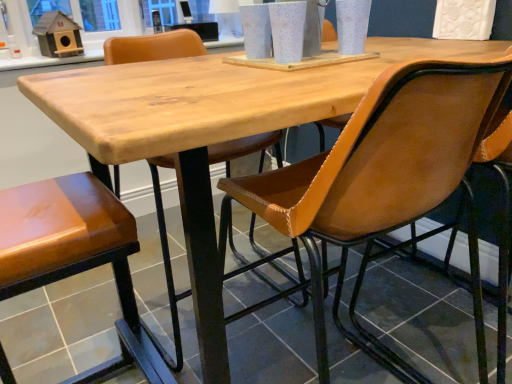
The width and height of the screenshot is (512, 384). What do you see at coordinates (76, 256) in the screenshot?
I see `glossy brown leather chair at lower left, positioned as the first chair in left-to-right order` at bounding box center [76, 256].

You are a GUI agent. You are given a task and a screenshot of the screen. Output one action in this format:
    pyautogui.click(x=<x>, y=<y>)
    Task: Click on the glossy brown leather chair at lower left, positioned as the 2th chair in right-to-left order
    
    Given the screenshot: What is the action you would take?
    pyautogui.click(x=76, y=256)

This screenshot has height=384, width=512. What are the coordinates of `brown leather chair at center, which ranks as the 2th chair in left-to-right order` in the screenshot? It's located at click(x=381, y=178).

Consider the image. In order to face brown leather chair at center, which ranks as the 2th chair in left-to-right order, should I rotate leftwards or rightwards?

It's best to rotate right around 12.313 degrees.

Describe the element at coordinates (381, 178) in the screenshot. I see `brown leather chair at center, which ranks as the 2th chair in left-to-right order` at that location.

Find the location of `glossy brown leather chair at lower left, positioned as the first chair in left-to-right order`. glossy brown leather chair at lower left, positioned as the first chair in left-to-right order is located at coordinates (76, 256).

Considering the positions of objects glossy brown leather chair at lower left, positioned as the first chair in left-to-right order, and brown leather chair at center, arranged as the first chair when viewed from the right, in the image provided, who is more to the left, glossy brown leather chair at lower left, positioned as the first chair in left-to-right order, or brown leather chair at center, arranged as the first chair when viewed from the right,?

glossy brown leather chair at lower left, positioned as the first chair in left-to-right order, is more to the left.

Based on the photo, which object is more forward, glossy brown leather chair at lower left, positioned as the 2th chair in right-to-left order, or brown leather chair at center, which ranks as the 2th chair in left-to-right order?

Answer: brown leather chair at center, which ranks as the 2th chair in left-to-right order, is closer to the camera.

Which is farther from the camera, [27,225] or [320,279]?

The point [320,279] is farther from the camera.

From the image's perspective, relative to brown leather chair at center, which ranks as the 2th chair in left-to-right order, is glossy brown leather chair at lower left, positioned as the first chair in left-to-right order, above or below?

glossy brown leather chair at lower left, positioned as the first chair in left-to-right order, is below brown leather chair at center, which ranks as the 2th chair in left-to-right order.

From a real-world perspective, is glossy brown leather chair at lower left, positioned as the first chair in left-to-right order, over brown leather chair at center, arranged as the first chair when viewed from the right?

No, from a real-world perspective, glossy brown leather chair at lower left, positioned as the first chair in left-to-right order, is not above brown leather chair at center, arranged as the first chair when viewed from the right.

Considering the sizes of glossy brown leather chair at lower left, positioned as the first chair in left-to-right order, and brown leather chair at center, arranged as the first chair when viewed from the right, in the image, is glossy brown leather chair at lower left, positioned as the first chair in left-to-right order, wider or thinner than brown leather chair at center, arranged as the first chair when viewed from the right,?

Clearly, glossy brown leather chair at lower left, positioned as the first chair in left-to-right order, has less width compared to brown leather chair at center, arranged as the first chair when viewed from the right.

Can you confirm if glossy brown leather chair at lower left, positioned as the first chair in left-to-right order, is shorter than brown leather chair at center, which ranks as the 2th chair in left-to-right order?

Yes.

Which of these two, glossy brown leather chair at lower left, positioned as the 2th chair in right-to-left order, or brown leather chair at center, arranged as the first chair when viewed from the right, is bigger?

With larger size is brown leather chair at center, arranged as the first chair when viewed from the right.

In the scene shown: Is glossy brown leather chair at lower left, positioned as the 2th chair in right-to-left order, outside of brown leather chair at center, which ranks as the 2th chair in left-to-right order?

glossy brown leather chair at lower left, positioned as the 2th chair in right-to-left order, lies outside brown leather chair at center, which ranks as the 2th chair in left-to-right order,'s area.

Is glossy brown leather chair at lower left, positioned as the first chair in left-to-right order, not near brown leather chair at center, arranged as the first chair when viewed from the right?

glossy brown leather chair at lower left, positioned as the first chair in left-to-right order, is near brown leather chair at center, arranged as the first chair when viewed from the right, not far away.

Is glossy brown leather chair at lower left, positioned as the 2th chair in right-to-left order, positioned with its back to brown leather chair at center, which ranks as the 2th chair in left-to-right order?

glossy brown leather chair at lower left, positioned as the 2th chair in right-to-left order, does not have its back to brown leather chair at center, which ranks as the 2th chair in left-to-right order.

How distant is glossy brown leather chair at lower left, positioned as the first chair in left-to-right order, from brown leather chair at center, arranged as the first chair when viewed from the right?

glossy brown leather chair at lower left, positioned as the first chair in left-to-right order, and brown leather chair at center, arranged as the first chair when viewed from the right, are 17.42 inches apart from each other.

Where is `chair above the glossy brown leather chair at lower left, positioned as the 2th chair in right-to-left order (from the image's perspective)`? chair above the glossy brown leather chair at lower left, positioned as the 2th chair in right-to-left order (from the image's perspective) is located at coordinates (381, 178).

Does brown leather chair at center, which ranks as the 2th chair in left-to-right order, appear on the left side of glossy brown leather chair at lower left, positioned as the 2th chair in right-to-left order?

No.

Is brown leather chair at center, arranged as the first chair when viewed from the right, positioned before glossy brown leather chair at lower left, positioned as the 2th chair in right-to-left order?

Yes, brown leather chair at center, arranged as the first chair when viewed from the right, is closer to the viewer.

Which point is more distant from viewer, (433, 133) or (54, 215)?

Positioned behind is point (54, 215).

From the image's perspective, would you say brown leather chair at center, arranged as the first chair when viewed from the right, is positioned over glossy brown leather chair at lower left, positioned as the 2th chair in right-to-left order?

Correct, brown leather chair at center, arranged as the first chair when viewed from the right, appears higher than glossy brown leather chair at lower left, positioned as the 2th chair in right-to-left order, in the image.

From a real-world perspective, which is physically above, brown leather chair at center, arranged as the first chair when viewed from the right, or glossy brown leather chair at lower left, positioned as the first chair in left-to-right order?

In real-world perspective, brown leather chair at center, arranged as the first chair when viewed from the right, is above.

Is brown leather chair at center, which ranks as the 2th chair in left-to-right order, wider or thinner than glossy brown leather chair at lower left, positioned as the 2th chair in right-to-left order?

Clearly, brown leather chair at center, which ranks as the 2th chair in left-to-right order, has more width compared to glossy brown leather chair at lower left, positioned as the 2th chair in right-to-left order.

Is brown leather chair at center, which ranks as the 2th chair in left-to-right order, taller or shorter than glossy brown leather chair at lower left, positioned as the 2th chair in right-to-left order?

In the image, brown leather chair at center, which ranks as the 2th chair in left-to-right order, appears to be taller than glossy brown leather chair at lower left, positioned as the 2th chair in right-to-left order.

Between brown leather chair at center, which ranks as the 2th chair in left-to-right order, and glossy brown leather chair at lower left, positioned as the first chair in left-to-right order, which one has larger size?

With larger size is brown leather chair at center, which ranks as the 2th chair in left-to-right order.

Is brown leather chair at center, arranged as the first chair when viewed from the right, located outside glossy brown leather chair at lower left, positioned as the 2th chair in right-to-left order?

Yes, brown leather chair at center, arranged as the first chair when viewed from the right, is outside of glossy brown leather chair at lower left, positioned as the 2th chair in right-to-left order.

In the scene shown: Is brown leather chair at center, which ranks as the 2th chair in left-to-right order, not near glossy brown leather chair at lower left, positioned as the first chair in left-to-right order?

brown leather chair at center, which ranks as the 2th chair in left-to-right order, is near glossy brown leather chair at lower left, positioned as the first chair in left-to-right order, not far away.

Is brown leather chair at center, arranged as the first chair when viewed from the right, positioned with its back to glossy brown leather chair at lower left, positioned as the 2th chair in right-to-left order?

brown leather chair at center, arranged as the first chair when viewed from the right, is not turned away from glossy brown leather chair at lower left, positioned as the 2th chair in right-to-left order.

Locate an element on the screen. chair behind the brown leather chair at center, arranged as the first chair when viewed from the right is located at coordinates (76, 256).

Where is `chair that is on the right side of glossy brown leather chair at lower left, positioned as the 2th chair in right-to-left order`? chair that is on the right side of glossy brown leather chair at lower left, positioned as the 2th chair in right-to-left order is located at coordinates (381, 178).

The height and width of the screenshot is (384, 512). I want to click on chair that appears below the brown leather chair at center, which ranks as the 2th chair in left-to-right order (from a real-world perspective), so click(76, 256).